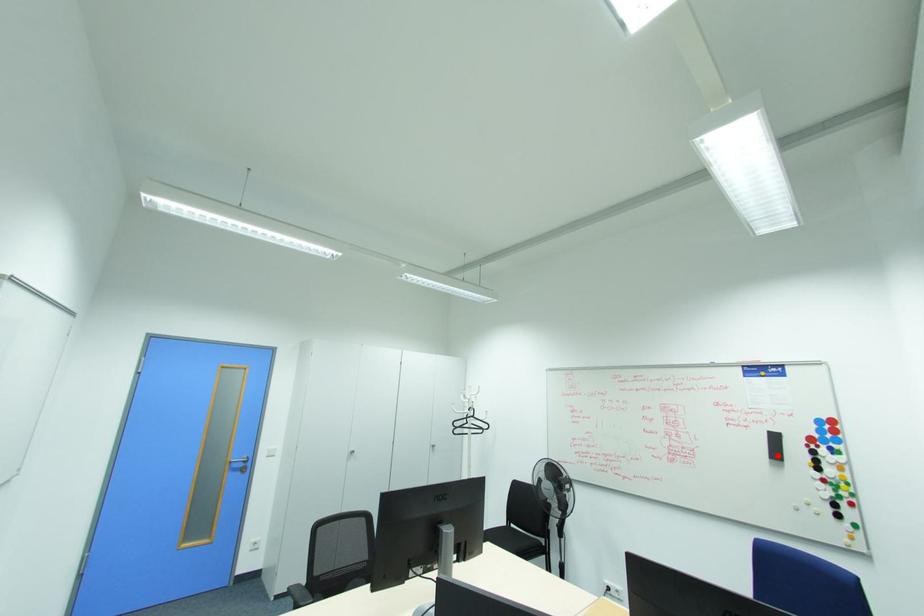
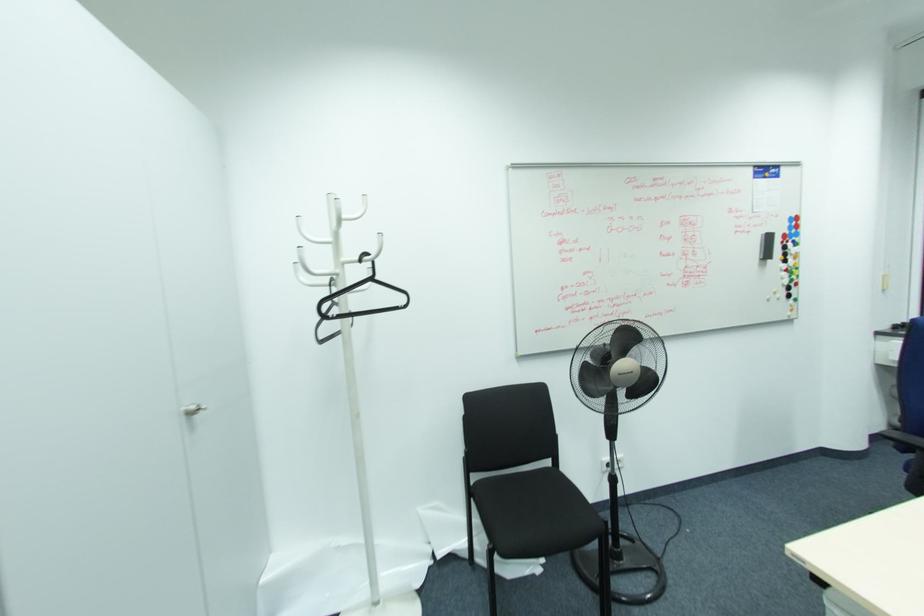
Question: I am providing you with two images of the same scene from different viewpoints. A red point is marked on the first image. At the location where the point appears in image 1, is it still visible in image 2?

Choices:
 (A) Yes
 (B) No

Answer: (A)